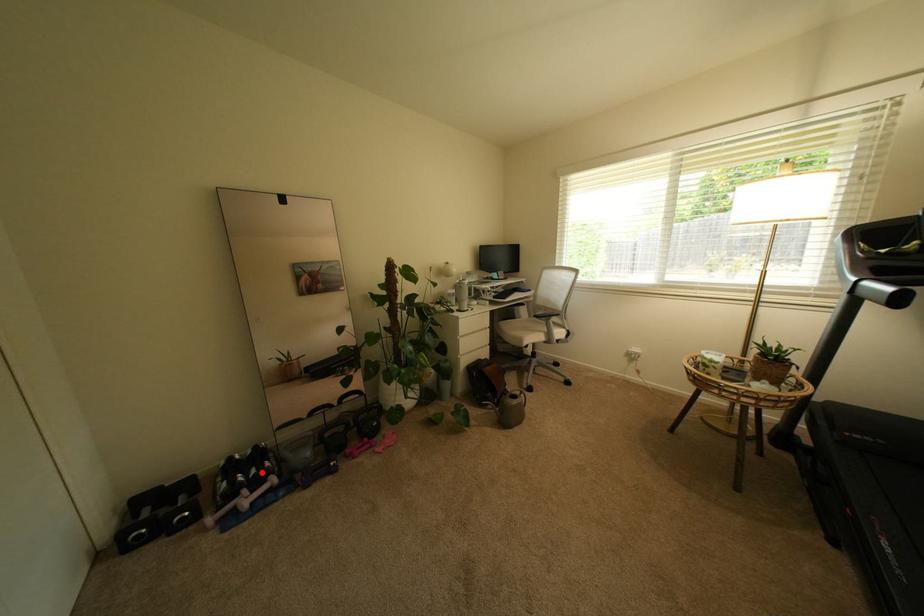
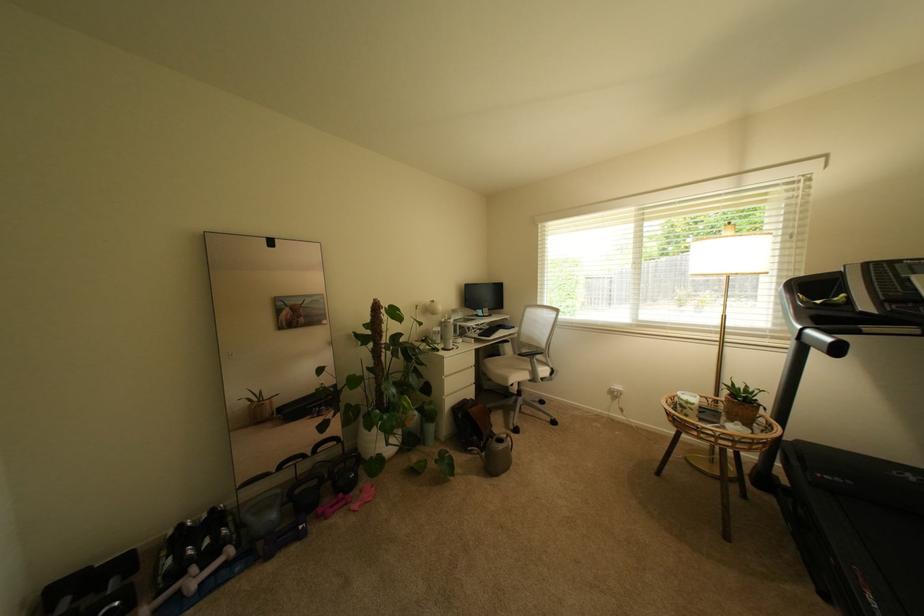
Locate, in the second image, the point that corresponds to the highlighted location in the first image.

(215, 543)